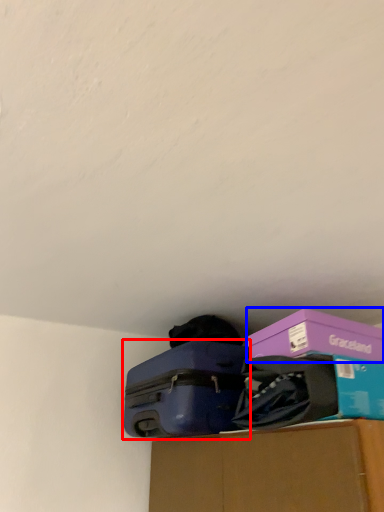
Question: Which point is further to the camera, suitcase (highlighted by a red box) or box (highlighted by a blue box)?

Choices:
 (A) suitcase
 (B) box

Answer: (A)